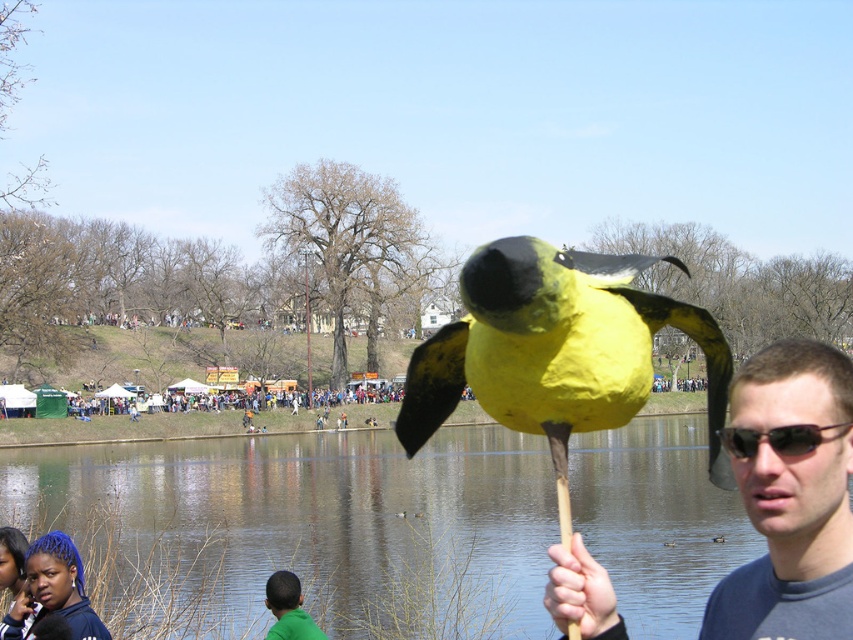
Question: Which point appears closest to the camera in this image?

Choices:
 (A) (286, 577)
 (B) (386, 554)

Answer: (A)

Question: In this image, where is clear water at lake center located relative to yellow paper bird at center?

Choices:
 (A) right
 (B) left

Answer: (B)

Question: Among these objects, which one is nearest to the camera?

Choices:
 (A) green matte shirt at lower center
 (B) matte yellow bird at center
 (C) sunglassestransparent at right

Answer: (C)

Question: Does matte yellow bird at center have a smaller size compared to green matte shirt at lower center?

Choices:
 (A) yes
 (B) no

Answer: (A)

Question: Where is yellow paper bird at center located in relation to green matte shirt at lower center in the image?

Choices:
 (A) right
 (B) left

Answer: (A)

Question: Which point appears farthest from the camera in this image?

Choices:
 (A) (787, 436)
 (B) (567, 337)

Answer: (B)